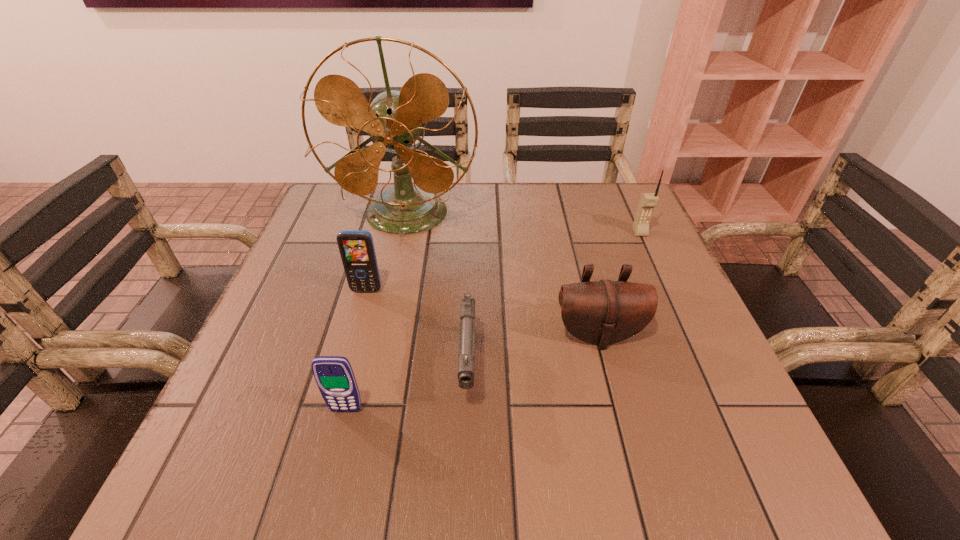
I want to click on the tallest object, so click(x=394, y=120).

The height and width of the screenshot is (540, 960). I want to click on the rightmost cellular telephone, so click(x=648, y=201).

The image size is (960, 540). In order to click on the rightmost object in this screenshot , I will do `click(648, 201)`.

Image resolution: width=960 pixels, height=540 pixels. In order to click on the second farthest cellular telephone in this screenshot , I will do `click(356, 247)`.

At what (x,y) coordinates should I click in order to perform the action: click on pouch. Please return your answer as a coordinate pair (x, y). The height and width of the screenshot is (540, 960). Looking at the image, I should click on (603, 312).

The width and height of the screenshot is (960, 540). What are the coordinates of `the nearest cellular telephone` in the screenshot? It's located at (334, 376).

Where is `gun`? gun is located at coordinates (466, 354).

You are a GUI agent. You are given a task and a screenshot of the screen. Output one action in this format:
    pyautogui.click(x=<x>, y=<y>)
    Task: Click on the vacant region located in front of the tallest object, directing air flow
    The width and height of the screenshot is (960, 540).
    Given the screenshot: What is the action you would take?
    pyautogui.click(x=381, y=329)

I want to click on free space located 0.360m on the front of the farthest cellular telephone, where the keypad is located, so [x=696, y=355].

Locate an element on the screen. vacant space located on the screen of the second nearest cellular telephone is located at coordinates (321, 456).